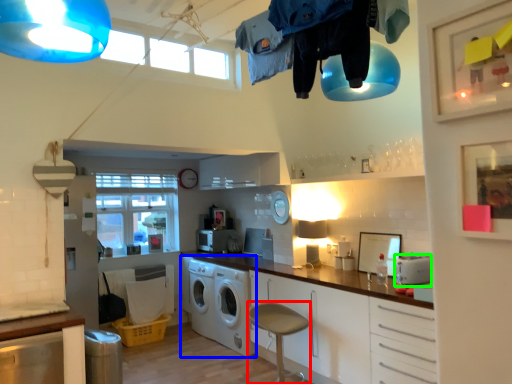
Question: Considering the real-world distances, which object is closest to bar stool (highlighted by a red box)? washing machine (highlighted by a blue box) or appliance (highlighted by a green box).

Choices:
 (A) washing machine
 (B) appliance

Answer: (A)